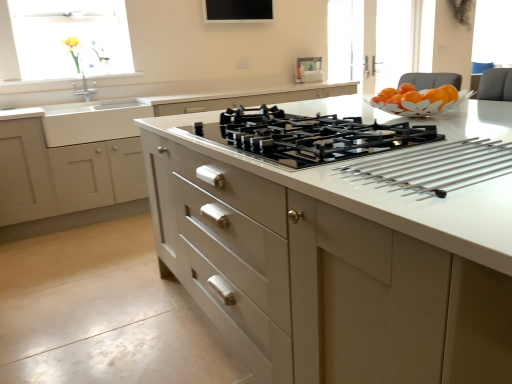
Question: Is translucent glass window at upper left oriented towards yellow matte flower at upper left?

Choices:
 (A) no
 (B) yes

Answer: (B)

Question: From the image's perspective, is translucent glass window at upper left on yellow matte flower at upper left?

Choices:
 (A) yes
 (B) no

Answer: (A)

Question: Is translucent glass window at upper left taller than yellow matte flower at upper left?

Choices:
 (A) yes
 (B) no

Answer: (A)

Question: Considering the relative sizes of translucent glass window at upper left and yellow matte flower at upper left in the image provided, is translucent glass window at upper left thinner than yellow matte flower at upper left?

Choices:
 (A) no
 (B) yes

Answer: (B)

Question: Is translucent glass window at upper left oriented away from yellow matte flower at upper left?

Choices:
 (A) no
 (B) yes

Answer: (B)

Question: Would you say translucent glass window at upper left is a long distance from yellow matte flower at upper left?

Choices:
 (A) no
 (B) yes

Answer: (A)

Question: Is yellow matte flower at upper left at the left side of matte white drawers at center?

Choices:
 (A) no
 (B) yes

Answer: (B)

Question: Is yellow matte flower at upper left facing away from matte white drawers at center?

Choices:
 (A) yes
 (B) no

Answer: (B)

Question: Can you confirm if yellow matte flower at upper left is bigger than matte white drawers at center?

Choices:
 (A) no
 (B) yes

Answer: (A)

Question: Considering the relative sizes of yellow matte flower at upper left and matte white drawers at center in the image provided, is yellow matte flower at upper left thinner than matte white drawers at center?

Choices:
 (A) no
 (B) yes

Answer: (B)

Question: From a real-world perspective, is yellow matte flower at upper left positioned over matte white drawers at center based on gravity?

Choices:
 (A) yes
 (B) no

Answer: (A)

Question: Does yellow matte flower at upper left come behind matte white drawers at center?

Choices:
 (A) no
 (B) yes

Answer: (B)

Question: Is black glass gas stove at center closer to camera compared to white glossy countertop at center?

Choices:
 (A) yes
 (B) no

Answer: (B)